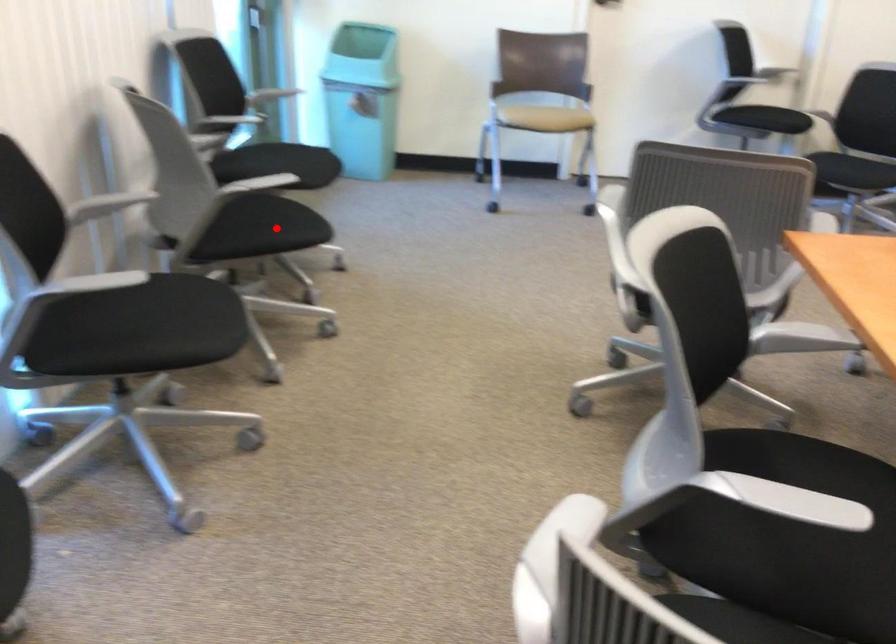
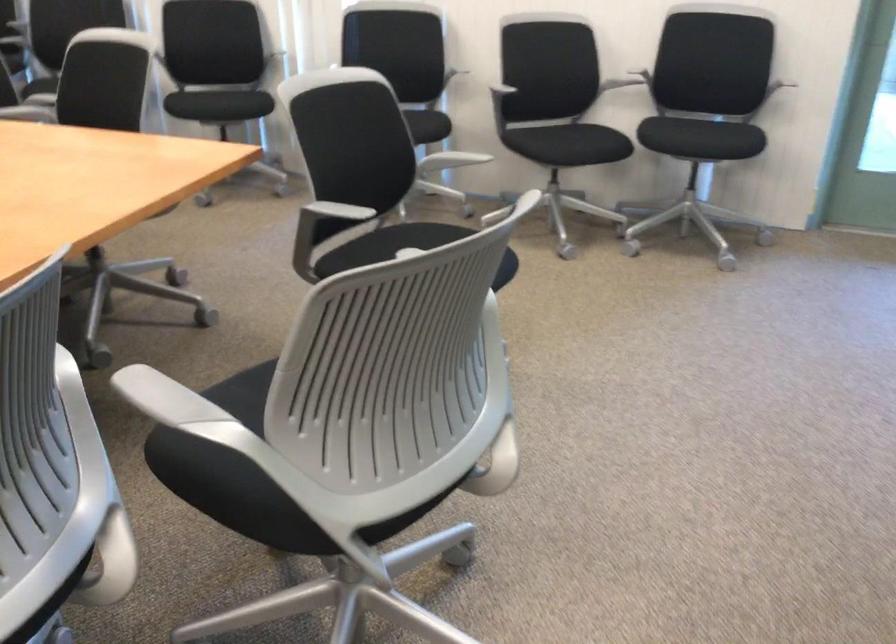
Find the pixel in the second image that matches the highlighted location in the first image.

(579, 144)